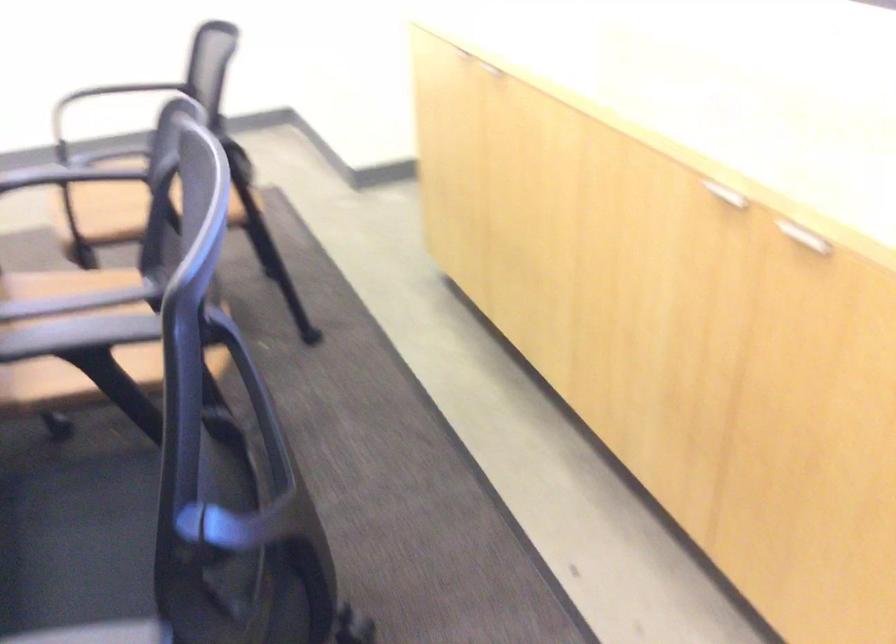
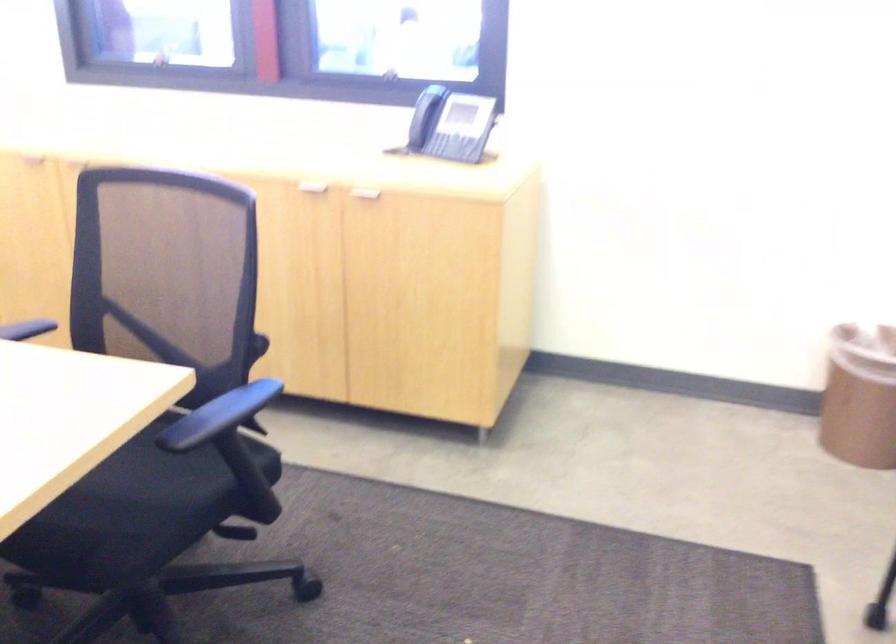
Find the pixel in the second image that matches (x=452, y=238) in the first image.

(38, 308)